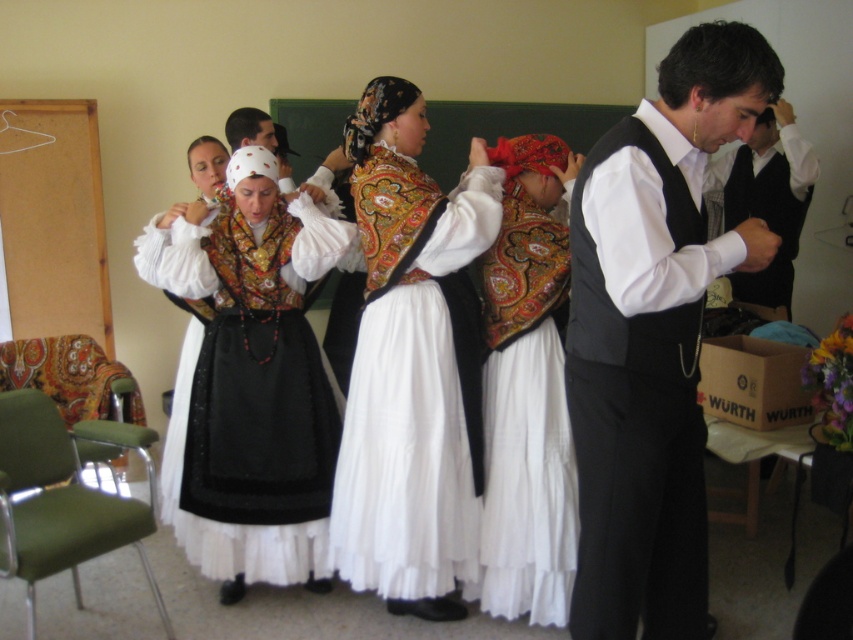
Question: Which is nearer to the matte black dress at center?

Choices:
 (A) black satin vest at center
 (B) white shirt at center

Answer: (A)

Question: Which point is closer to the camera?

Choices:
 (A) velvet-patterned armchair at left
 (B) white shirt at center
 (C) matte black dress at center
 (D) green fabric armchair at lower left

Answer: (D)

Question: Does embroidered silk blouse at center appear on the right side of matte black dress at center?

Choices:
 (A) no
 (B) yes

Answer: (B)

Question: Which of these objects is positioned farthest from the embroidered silk blouse at center?

Choices:
 (A) green fabric armchair at lower left
 (B) matte gold brocade vest at center
 (C) black satin vest at center

Answer: (A)

Question: Does matte black dress at center have a greater width compared to velvet-patterned armchair at left?

Choices:
 (A) no
 (B) yes

Answer: (B)

Question: Is embroidered silk blouse at center below velvet-patterned armchair at left?

Choices:
 (A) no
 (B) yes

Answer: (A)